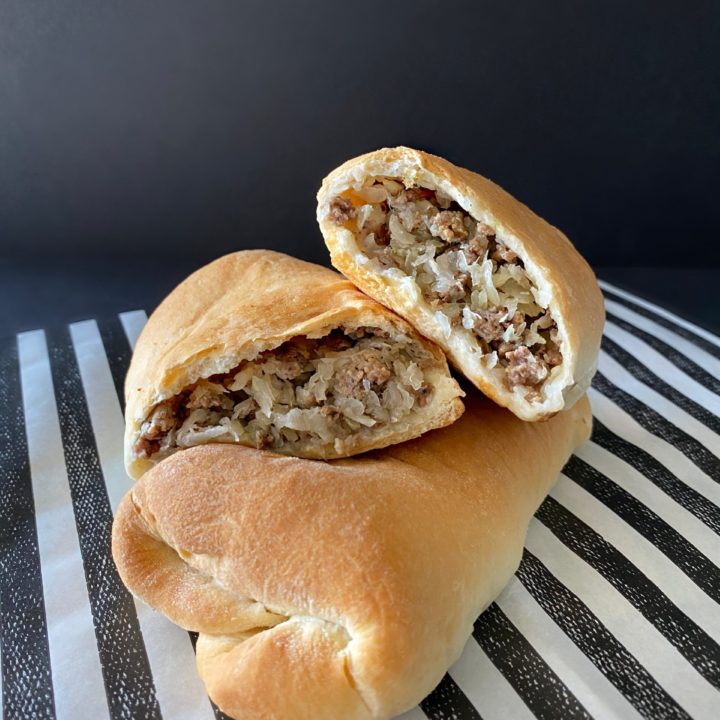
Locate an element on the screen. table is located at coordinates (94, 556).